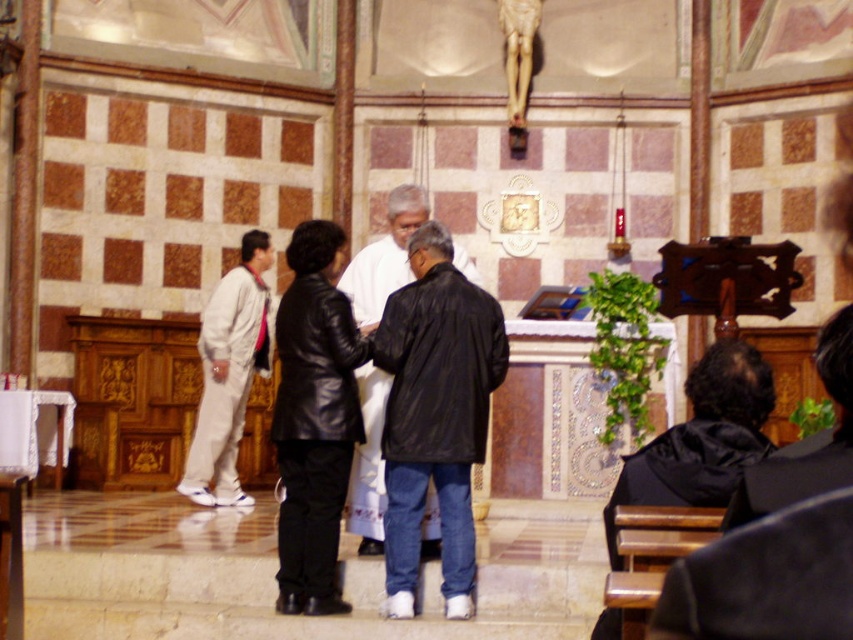
You are standing at the entrance of the church and want to approach the black leather jacket at lower right and the light beige fabric pants at left. Which one is farther from your current position?

The black leather jacket at lower right is 68.98 feet away from the light beige fabric pants at left, so the one farther from your current position depends on their exact locations. However, since the distance between them is given, but without knowing your starting point, it is impossible to determine which is farther without additional information.